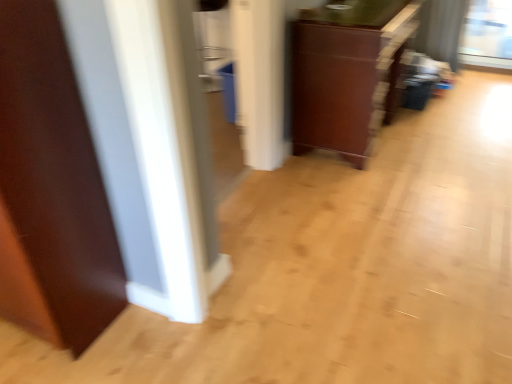
Question: Based on their sizes in the image, would you say brown wood door at left is bigger or smaller than matte brown cabinet at center?

Choices:
 (A) big
 (B) small

Answer: (B)

Question: Is point (32, 46) positioned closer to the camera than point (298, 49)?

Choices:
 (A) closer
 (B) farther

Answer: (A)

Question: Is brown wood door at left to the left or to the right of matte brown cabinet at center in the image?

Choices:
 (A) left
 (B) right

Answer: (A)

Question: Looking at their shapes, would you say matte brown cabinet at center is wider or thinner than brown wood door at left?

Choices:
 (A) wide
 (B) thin

Answer: (A)

Question: Is point (348, 132) positioned closer to the camera than point (24, 19)?

Choices:
 (A) farther
 (B) closer

Answer: (A)

Question: From their relative heights in the image, would you say matte brown cabinet at center is taller or shorter than brown wood door at left?

Choices:
 (A) tall
 (B) short

Answer: (B)

Question: Considering their positions, is matte brown cabinet at center located in front of or behind brown wood door at left?

Choices:
 (A) behind
 (B) front

Answer: (A)